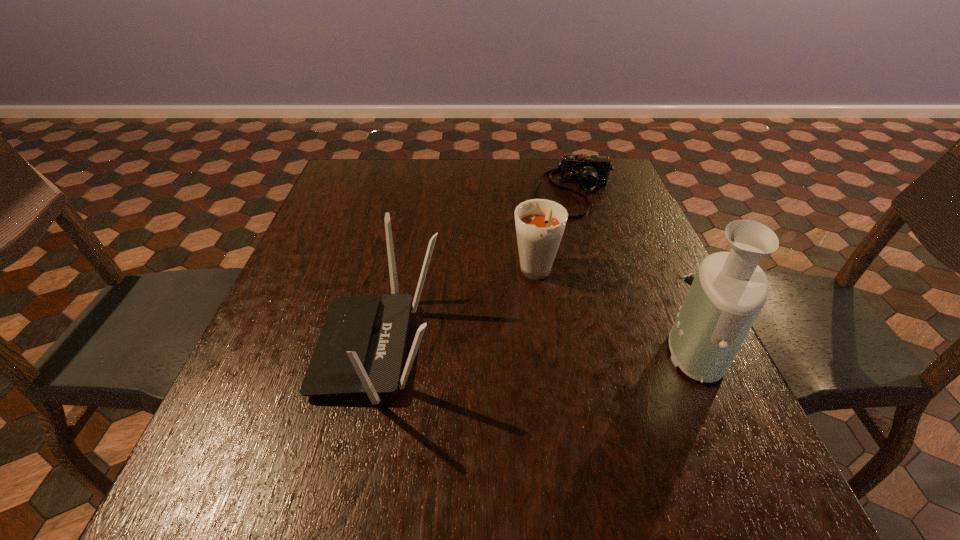
Where is `vacant space in between the camera and the router`? The height and width of the screenshot is (540, 960). vacant space in between the camera and the router is located at coordinates (477, 271).

You are a GUI agent. You are given a task and a screenshot of the screen. Output one action in this format:
    pyautogui.click(x=<x>, y=<y>)
    Task: Click on the free space between the tallest object and the shortest object
    
    Given the screenshot: What is the action you would take?
    pyautogui.click(x=638, y=272)

The width and height of the screenshot is (960, 540). I want to click on free space between the tallest object and the root beer, so click(619, 313).

You are a GUI agent. You are given a task and a screenshot of the screen. Output one action in this format:
    pyautogui.click(x=<x>, y=<y>)
    Task: Click on the vacant space that is in between the farthest object and the juicer
    This screenshot has height=540, width=960.
    Given the screenshot: What is the action you would take?
    pyautogui.click(x=638, y=272)

I want to click on free space between the tallest object and the farthest object, so click(638, 272).

Locate an element on the screen. This screenshot has height=540, width=960. unoccupied position between the leftmost object and the shortest object is located at coordinates (477, 271).

Identify the location of vacant region between the leftmost object and the juicer. (540, 350).

In order to click on free point between the root beer and the tallest object in this screenshot , I will do `click(619, 313)`.

Identify which object is the third nearest to the root beer. Please provide its 2D coordinates. Your answer should be formatted as a tuple, i.e. [(x, y)], where the tuple contains the x and y coordinates of a point satisfying the conditions above.

[(729, 290)]

Identify the location of object that stands as the second closest to the root beer. This screenshot has height=540, width=960. (360, 348).